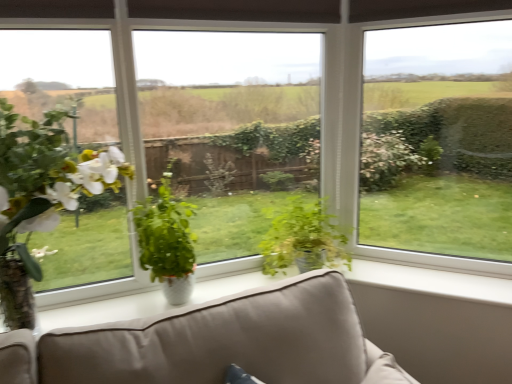
The image size is (512, 384). Describe the element at coordinates (167, 241) in the screenshot. I see `green glossy plant at center, the 2th houseplant viewed from the left` at that location.

The height and width of the screenshot is (384, 512). Identify the location of green glossy plant at center, the 2th houseplant viewed from the left. (167, 241).

Locate an element on the screen. green glossy plant at center, which ranks as the first houseplant in right-to-left order is located at coordinates (302, 239).

Image resolution: width=512 pixels, height=384 pixels. In order to click on green glossy plant at center, the 2th houseplant viewed from the left in this screenshot , I will do `click(167, 241)`.

Is green matte plant at left, which is the first houseplant from left to right, beside transparent glass window at center?

green matte plant at left, which is the first houseplant from left to right, and transparent glass window at center are clearly separated.

Considering the relative positions of green matte plant at left, which is the first houseplant from left to right, and transparent glass window at center in the image provided, is green matte plant at left, which is the first houseplant from left to right, to the left of transparent glass window at center from the viewer's perspective?

Indeed, green matte plant at left, which is the first houseplant from left to right, is positioned on the left side of transparent glass window at center.

Who is smaller, green matte plant at left, which is counted as the 3th houseplant, starting from the right, or transparent glass window at center?

transparent glass window at center is smaller.

From the image's perspective, is transparent glass window at center on transparent glass window at center?

Incorrect, from the image's perspective, transparent glass window at center is lower than transparent glass window at center.

Is transparent glass window at center further to camera compared to transparent glass window at center?

Yes, the depth of transparent glass window at center is greater than that of transparent glass window at center.

Considering the relative sizes of transparent glass window at center and transparent glass window at center in the image provided, is transparent glass window at center shorter than transparent glass window at center?

Yes.

Is transparent glass window at center positioned far away from green glossy plant at center, the 2th houseplant viewed from the left?

No.

Which is in front, transparent glass window at center or green glossy plant at center, the 2th houseplant viewed from the left?

green glossy plant at center, the 2th houseplant viewed from the left, is in front.

Measure the distance between transparent glass window at center and green glossy plant at center, which is counted as the 2th houseplant, starting from the right.

37.31 inches.

Can you confirm if transparent glass window at center is positioned to the right of green glossy plant at center, which is counted as the 2th houseplant, starting from the right?

Yes, transparent glass window at center is to the right of green glossy plant at center, which is counted as the 2th houseplant, starting from the right.

Is point (381, 88) farther from viewer compared to point (271, 260)?

No, it is in front of (271, 260).

Choose the correct answer: Is transparent glass window at center inside green glossy plant at center, which ranks as the first houseplant in right-to-left order, or outside it?

transparent glass window at center is outside green glossy plant at center, which ranks as the first houseplant in right-to-left order.

Is transparent glass window at center not close to green glossy plant at center, which ranks as the first houseplant in right-to-left order?

They are positioned close to each other.

Considering the sizes of objects transparent glass window at center and green matte plant at left, which is counted as the 3th houseplant, starting from the right, in the image provided, who is bigger, transparent glass window at center or green matte plant at left, which is counted as the 3th houseplant, starting from the right,?

green matte plant at left, which is counted as the 3th houseplant, starting from the right.

In terms of height, does transparent glass window at center look taller or shorter compared to green matte plant at left, which is the first houseplant from left to right?

In the image, transparent glass window at center appears to be taller than green matte plant at left, which is the first houseplant from left to right.

Between transparent glass window at center and green matte plant at left, which is counted as the 3th houseplant, starting from the right, which one has larger width?

Wider between the two is green matte plant at left, which is counted as the 3th houseplant, starting from the right.

From the picture: Is transparent glass window at center beside green matte plant at left, which is the first houseplant from left to right?

No, transparent glass window at center is not in contact with green matte plant at left, which is the first houseplant from left to right.

From a real-world perspective, is green matte plant at left, which is the first houseplant from left to right, located beneath transparent glass window at center?

Correct, in the physical world, green matte plant at left, which is the first houseplant from left to right, is lower than transparent glass window at center.

Between green matte plant at left, which is counted as the 3th houseplant, starting from the right, and transparent glass window at center, which one appears on the left side from the viewer's perspective?

green matte plant at left, which is counted as the 3th houseplant, starting from the right, is more to the left.

Does point (12, 183) come in front of point (494, 142)?

Yes, point (12, 183) is in front of point (494, 142).

Considering the sizes of objects green matte plant at left, which is counted as the 3th houseplant, starting from the right, and transparent glass window at center in the image provided, who is smaller, green matte plant at left, which is counted as the 3th houseplant, starting from the right, or transparent glass window at center?

Smaller between the two is transparent glass window at center.

Is green glossy plant at center, the 2th houseplant viewed from the left, located within green matte plant at left, which is counted as the 3th houseplant, starting from the right?

Definitely not — green glossy plant at center, the 2th houseplant viewed from the left, is not inside green matte plant at left, which is counted as the 3th houseplant, starting from the right.

Which of these two, green matte plant at left, which is counted as the 3th houseplant, starting from the right, or green glossy plant at center, which is counted as the 2th houseplant, starting from the right, stands taller?

green matte plant at left, which is counted as the 3th houseplant, starting from the right, is taller.

How different are the orientations of green matte plant at left, which is counted as the 3th houseplant, starting from the right, and green glossy plant at center, the 2th houseplant viewed from the left, in degrees?

The angle between the facing direction of green matte plant at left, which is counted as the 3th houseplant, starting from the right, and the facing direction of green glossy plant at center, the 2th houseplant viewed from the left, is 0.000503 degrees.

Considering the relative positions of green matte plant at left, which is counted as the 3th houseplant, starting from the right, and green glossy plant at center, which is counted as the 2th houseplant, starting from the right, in the image provided, is green matte plant at left, which is counted as the 3th houseplant, starting from the right, in front of green glossy plant at center, which is counted as the 2th houseplant, starting from the right,?

Yes, it is.

Where is `window screen located above the green matte plant at left, which is the first houseplant from left to right (from the image's perspective)`? The width and height of the screenshot is (512, 384). window screen located above the green matte plant at left, which is the first houseplant from left to right (from the image's perspective) is located at coordinates (229, 124).

Locate an element on the screen. window screen below the transparent glass window at center (from a real-world perspective) is located at coordinates (229, 124).

When comparing their distances from green matte plant at left, which is the first houseplant from left to right, does transparent glass window at center or transparent glass window at center seem closer?

transparent glass window at center lies closer to green matte plant at left, which is the first houseplant from left to right, than the other object.

Estimate the real-world distances between objects in this image. Which object is closer to transparent glass window at center, green matte plant at left, which is counted as the 3th houseplant, starting from the right, or green glossy plant at center, which is counted as the 2th houseplant, starting from the right?

The object closer to transparent glass window at center is green glossy plant at center, which is counted as the 2th houseplant, starting from the right.

Considering their positions, is transparent glass window at center positioned further to green matte plant at left, which is counted as the 3th houseplant, starting from the right, than green glossy plant at center, the 3th houseplant when ordered from left to right?

The object further to green matte plant at left, which is counted as the 3th houseplant, starting from the right, is green glossy plant at center, the 3th houseplant when ordered from left to right.

Considering their positions, is green glossy plant at center, which ranks as the first houseplant in right-to-left order, positioned further to transparent glass window at center than green glossy plant at center, the 2th houseplant viewed from the left?

green glossy plant at center, which ranks as the first houseplant in right-to-left order.

When comparing their distances from green glossy plant at center, which is counted as the 2th houseplant, starting from the right, does green glossy plant at center, the 3th houseplant when ordered from left to right, or transparent glass window at center seem closer?

Among the two, transparent glass window at center is located nearer to green glossy plant at center, which is counted as the 2th houseplant, starting from the right.

Which object lies further to the anchor point transparent glass window at center, green glossy plant at center, the 3th houseplant when ordered from left to right, or green glossy plant at center, which is counted as the 2th houseplant, starting from the right?

Among the two, green glossy plant at center, which is counted as the 2th houseplant, starting from the right, is located further to transparent glass window at center.

From the image, which object appears to be nearer to transparent glass window at center, green glossy plant at center, the 2th houseplant viewed from the left, or green glossy plant at center, which ranks as the first houseplant in right-to-left order?

Based on the image, green glossy plant at center, which ranks as the first houseplant in right-to-left order, appears to be nearer to transparent glass window at center.

Looking at the image, which one is located further to green glossy plant at center, the 3th houseplant when ordered from left to right, green matte plant at left, which is the first houseplant from left to right, or transparent glass window at center?

green matte plant at left, which is the first houseplant from left to right, is further to green glossy plant at center, the 3th houseplant when ordered from left to right.

You are a GUI agent. You are given a task and a screenshot of the screen. Output one action in this format:
    pyautogui.click(x=<x>, y=<y>)
    Task: Click on the houseplant situated between green glossy plant at center, which is counted as the 2th houseplant, starting from the right, and transparent glass window at center from left to right
    This screenshot has width=512, height=384.
    Given the screenshot: What is the action you would take?
    pyautogui.click(x=302, y=239)

Locate an element on the screen. Image resolution: width=512 pixels, height=384 pixels. window screen located between green matte plant at left, which is the first houseplant from left to right, and green glossy plant at center, which ranks as the first houseplant in right-to-left order, in the left-right direction is located at coordinates (229, 124).

I want to click on window screen between green glossy plant at center, which is counted as the 2th houseplant, starting from the right, and transparent glass window at center from left to right, so click(229, 124).

The image size is (512, 384). Find the location of `houseplant between transparent glass window at center and transparent glass window at center from left to right`. houseplant between transparent glass window at center and transparent glass window at center from left to right is located at coordinates (302, 239).